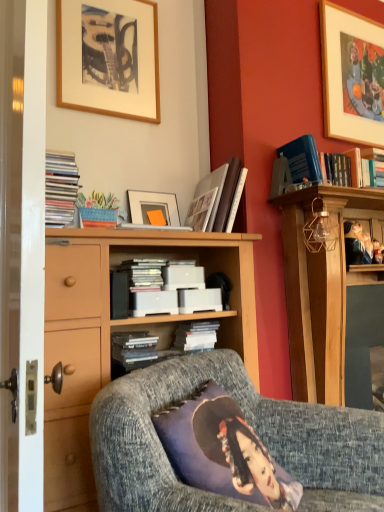
Question: Is smooth wooden frame at upper right, the 2th person when ordered from left to right, inside the boundaries of smooth wooden frame at upper right, positioned as the first person in left-to-right order, or outside?

Choices:
 (A) inside
 (B) outside

Answer: (B)

Question: Relative to smooth wooden frame at upper right, positioned as the first person in left-to-right order, is smooth wooden frame at upper right, the 2th person when ordered from left to right, in front or behind?

Choices:
 (A) front
 (B) behind

Answer: (B)

Question: Estimate the real-world distances between objects in this image. Which object is closer to the white matte book at center, which is counted as the 1th book, starting from the bottom?

Choices:
 (A) matte black books at left, the first book positioned from the left
 (B) smooth wooden frame at upper right, the 2th person when ordered from left to right
 (C) textured gray armchair at center
 (D) white matte book at center, the second book from the right
 (E) wooden picture frame at upper right, which is the 2th picture frame from left to right

Answer: (D)

Question: Estimate the real-world distances between objects in this image. Which object is farther from the hardcover book at upper right, the first book viewed from the top?

Choices:
 (A) wooden picture frame at upper left, the 1th picture frame viewed from the left
 (B) smooth wooden frame at upper right, positioned as the first person in left-to-right order
 (C) textured gray armchair at center
 (D) wooden picture frame at upper right, which is the 2th picture frame from left to right
 (E) white matte book at center, the third book viewed from the right

Answer: (E)